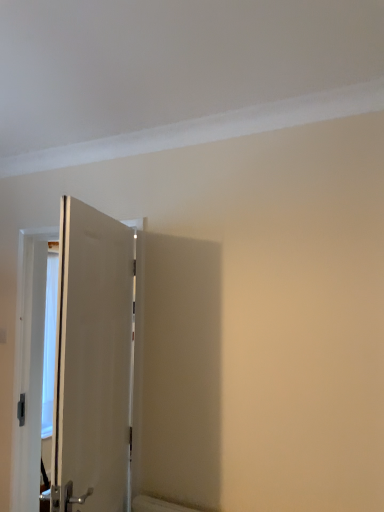
This screenshot has height=512, width=384. In order to click on white glossy door at left in this screenshot , I will do `click(93, 362)`.

What do you see at coordinates (93, 362) in the screenshot?
I see `white glossy door at left` at bounding box center [93, 362].

Locate an element on the screen. white glossy door at left is located at coordinates (93, 362).